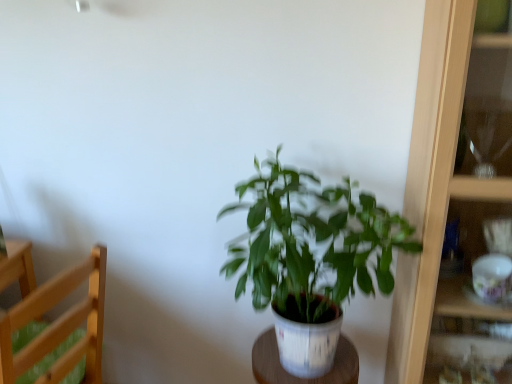
Question: Choose the correct answer: Is white wood table at center inside green matte plant at center or outside it?

Choices:
 (A) inside
 (B) outside

Answer: (B)

Question: From a real-world perspective, is white wood table at center above or below green matte plant at center?

Choices:
 (A) below
 (B) above

Answer: (A)

Question: Estimate the real-world distances between objects in this image. Which object is farther from the green matte plant at center?

Choices:
 (A) white wood table at center
 (B) light wood chair at left
 (C) wooden cabinet at right

Answer: (B)

Question: Estimate the real-world distances between objects in this image. Which object is closer to the light wood chair at left?

Choices:
 (A) white wood table at center
 (B) wooden cabinet at right
 (C) green matte plant at center

Answer: (C)